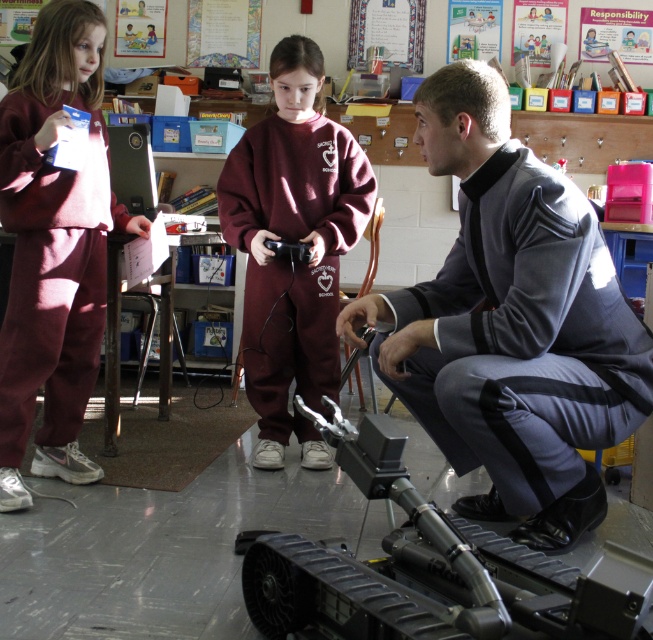
You are a student in the classroom and want to reach both the point at coordinates (x=599, y=497) and the point at coordinates (x=59, y=45). Which point should you walk towards first to reach the closer one first?

You should walk towards point (x=599, y=497) first because it is closer to you than point (x=59, y=45).